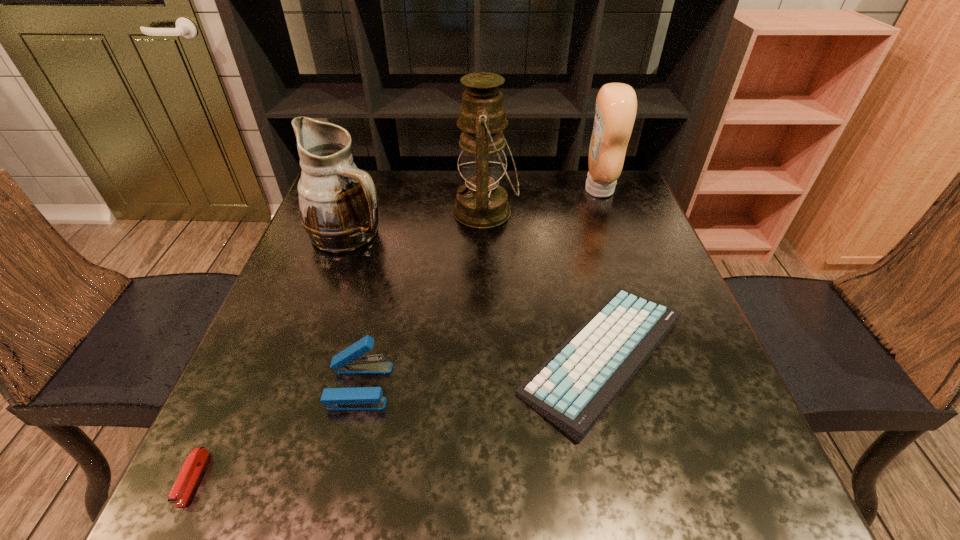
Find the location of a particular element. vacant point located between the tallest object and the condiment is located at coordinates (542, 200).

This screenshot has width=960, height=540. What are the coordinates of `free spot between the pitcher and the right stapler` in the screenshot? It's located at (354, 310).

Identify the location of vacant space in between the computer keyboard and the shorter stapler. This screenshot has width=960, height=540. (397, 417).

Where is `vacant region between the tallest object and the condiment`? vacant region between the tallest object and the condiment is located at coordinates (542, 200).

Locate an element on the screen. This screenshot has width=960, height=540. unoccupied position between the shorter stapler and the tallest object is located at coordinates (339, 345).

Find the location of a particular element. The height and width of the screenshot is (540, 960). free spot between the fourth tallest object and the left stapler is located at coordinates (276, 433).

This screenshot has height=540, width=960. I want to click on vacant area between the condiment and the nearest object, so click(x=396, y=334).

This screenshot has height=540, width=960. Identify the location of free space between the nearest object and the pitcher. (272, 356).

Identify which object is the fifth closest to the nearer stapler. Please provide its 2D coordinates. Your answer should be formatted as a tuple, i.e. [(x, y)], where the tuple contains the x and y coordinates of a point satisfying the conditions above.

[(616, 104)]

The image size is (960, 540). In order to click on object that is the third closest to the condiment in this screenshot , I will do `click(338, 202)`.